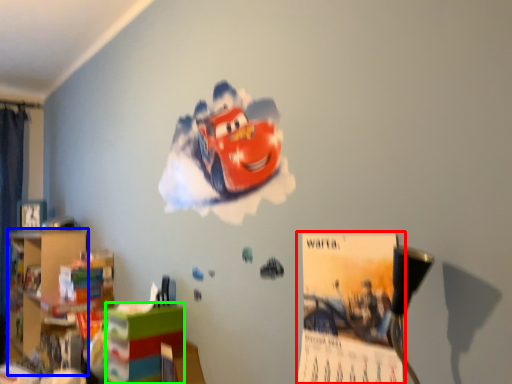
Question: Estimate the real-world distances between objects in this image. Which object is farther from poster page (highlighted by a red box), bookshelf (highlighted by a blue box) or shelf (highlighted by a green box)?

Choices:
 (A) bookshelf
 (B) shelf

Answer: (A)